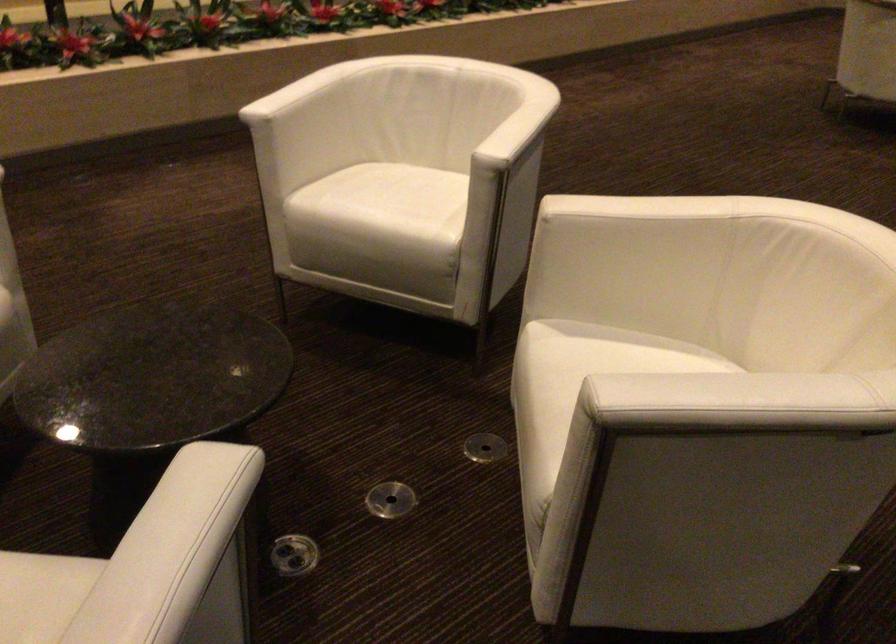
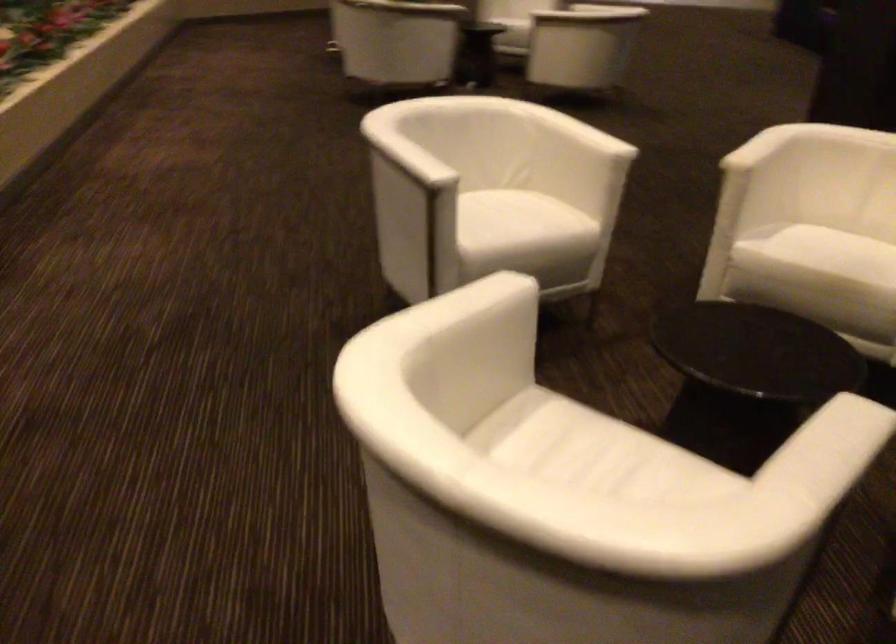
Question: I am providing you with two images of the same scene from different viewpoints. Please identify which objects are invisible in image2.

Choices:
 (A) white chair armrest
 (B) white chair sitting surface
 (C) round floor cover
 (D) white cylindrical holder

Answer: (C)